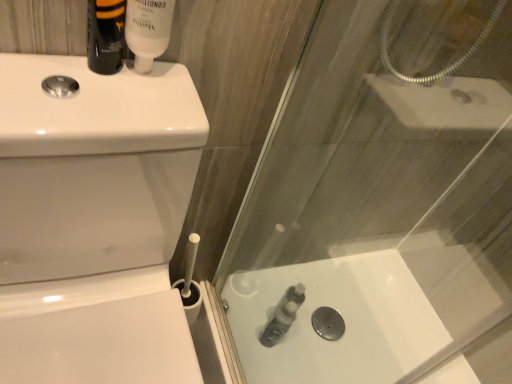
Question: Is translucent plastic bottle at lower center, the 1th toiletry positioned from the back, at the right side of matte black bottle at upper left, the second toiletry in the bottom-to-top sequence?

Choices:
 (A) yes
 (B) no

Answer: (A)

Question: Is translucent plastic bottle at lower center, positioned as the first toiletry in right-to-left order, outside of matte black bottle at upper left, the 3th toiletry when ordered from right to left?

Choices:
 (A) yes
 (B) no

Answer: (A)

Question: Is translucent plastic bottle at lower center, placed as the third toiletry when sorted from top to bottom, bigger than matte black bottle at upper left, the 2th toiletry from the top?

Choices:
 (A) yes
 (B) no

Answer: (A)

Question: Is translucent plastic bottle at lower center, which is counted as the 3th toiletry, starting from the left, thinner than matte black bottle at upper left, the 3th toiletry when ordered from right to left?

Choices:
 (A) yes
 (B) no

Answer: (B)

Question: Is translucent plastic bottle at lower center, arranged as the 3th toiletry when viewed from the front, taller than matte black bottle at upper left, the 2th toiletry from the top?

Choices:
 (A) no
 (B) yes

Answer: (B)

Question: Is white glossy toilet bowl at left wider or thinner than white glossy tube at upper center, arranged as the second toiletry when viewed from the right?

Choices:
 (A) wide
 (B) thin

Answer: (A)

Question: From a real-world perspective, is white glossy toilet bowl at left positioned above or below white glossy tube at upper center, acting as the second toiletry starting from the back?

Choices:
 (A) above
 (B) below

Answer: (B)

Question: From their relative heights in the image, would you say white glossy toilet bowl at left is taller or shorter than white glossy tube at upper center, the second toiletry positioned from the front?

Choices:
 (A) tall
 (B) short

Answer: (A)

Question: Considering their positions, is white glossy toilet bowl at left located in front of or behind white glossy tube at upper center, the second toiletry positioned from the front?

Choices:
 (A) behind
 (B) front

Answer: (B)

Question: Considering the positions of translucent plastic bottle at lower center and white glossy toilet bowl at left in the image, is translucent plastic bottle at lower center bigger or smaller than white glossy toilet bowl at left?

Choices:
 (A) big
 (B) small

Answer: (B)

Question: Is point (350, 349) closer or farther from the camera than point (77, 162)?

Choices:
 (A) farther
 (B) closer

Answer: (A)

Question: Considering the positions of translucent plastic bottle at lower center and white glossy toilet bowl at left in the image, is translucent plastic bottle at lower center wider or thinner than white glossy toilet bowl at left?

Choices:
 (A) wide
 (B) thin

Answer: (A)

Question: Is translucent plastic bottle at lower center taller or shorter than white glossy toilet bowl at left?

Choices:
 (A) tall
 (B) short

Answer: (B)

Question: Relative to white glossy tube at upper center, arranged as the second toiletry when viewed from the right, is translucent plastic bottle at lower center in front or behind?

Choices:
 (A) front
 (B) behind

Answer: (B)

Question: Is point (387, 284) positioned closer to the camera than point (158, 48)?

Choices:
 (A) farther
 (B) closer

Answer: (A)